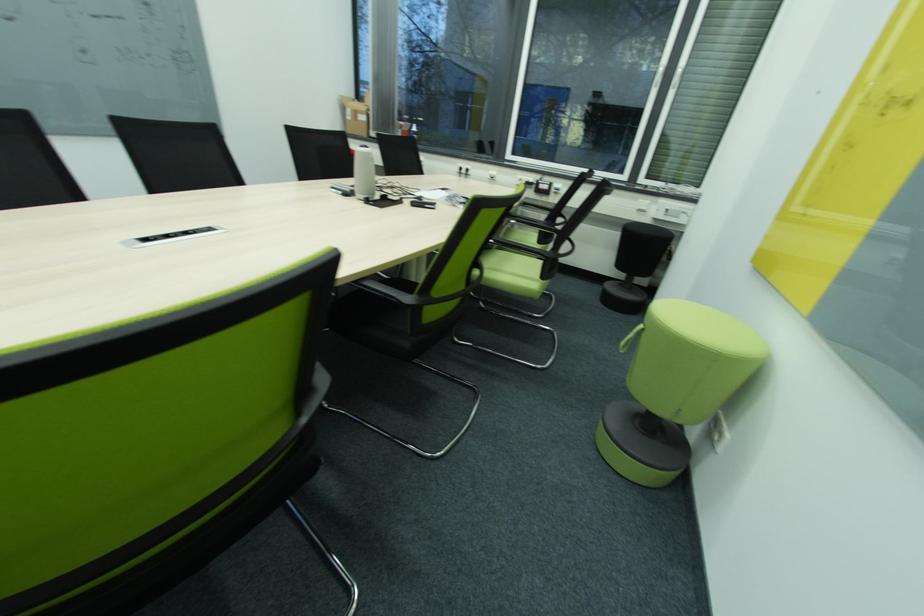
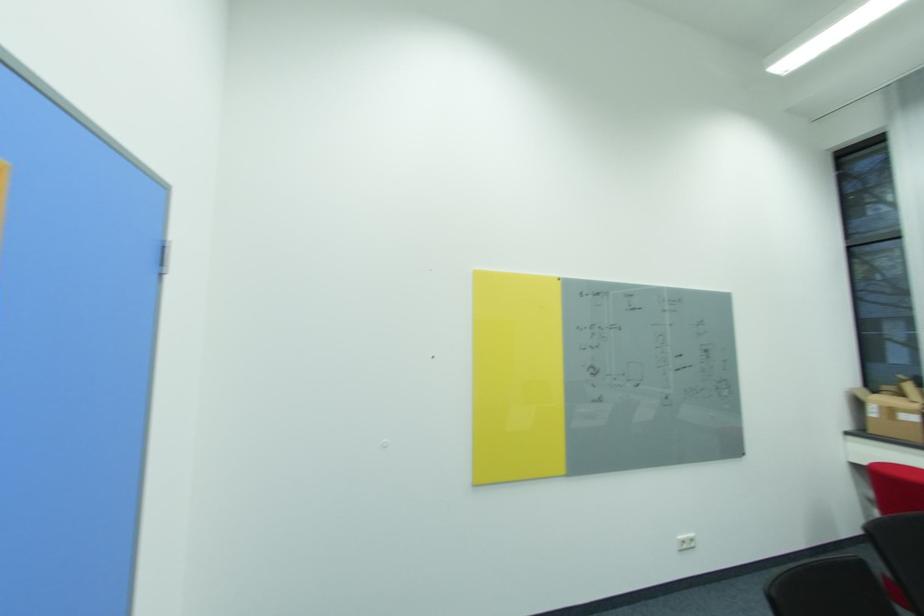
In the second image, find the point that corresponds to pixel 360 114 in the first image.

(895, 411)